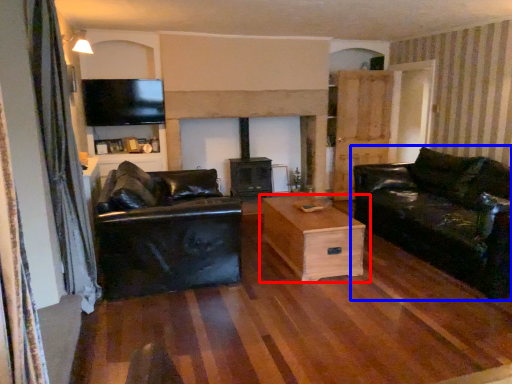
Question: Which object is further to the camera taking this photo, table (highlighted by a red box) or studio couch (highlighted by a blue box)?

Choices:
 (A) table
 (B) studio couch

Answer: (A)